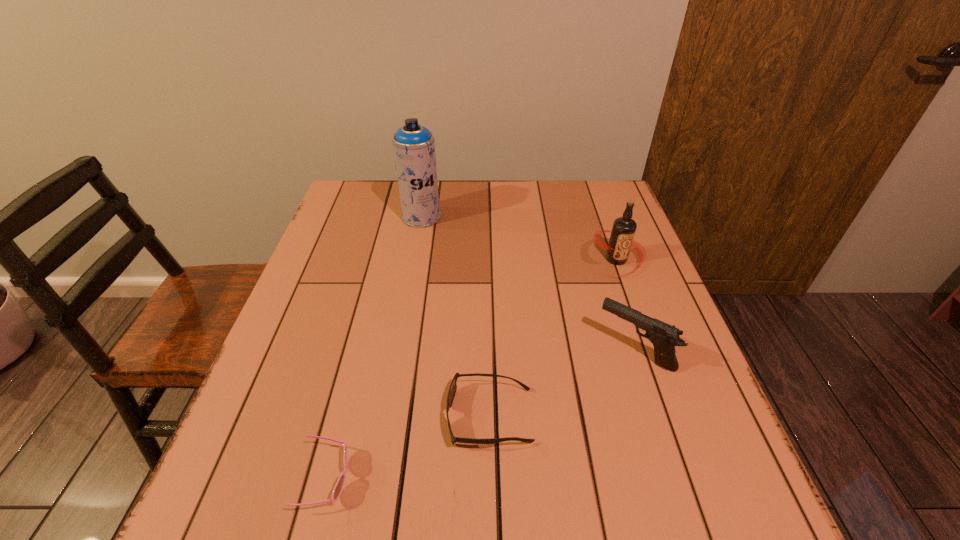
What are the coordinates of `empty space between the gun and the tallest object` in the screenshot? It's located at (528, 284).

Identify the location of vacant region between the left sunglasses and the farthest object. (373, 348).

This screenshot has width=960, height=540. What are the coordinates of `free point between the right sunglasses and the left sunglasses` in the screenshot? It's located at (408, 448).

At what (x,y) coordinates should I click in order to perform the action: click on free spot between the aerosol can and the root beer. Please return your answer as a coordinate pair (x, y). This screenshot has width=960, height=540. Looking at the image, I should click on (519, 238).

Where is `vacant area that lies between the farthest object and the left sunglasses`? The width and height of the screenshot is (960, 540). vacant area that lies between the farthest object and the left sunglasses is located at coordinates (373, 348).

Find the location of a particular element. This screenshot has width=960, height=540. free spot between the gun and the aerosol can is located at coordinates (528, 284).

Find the location of `free space that is in between the left sunglasses and the third object from right to left`. free space that is in between the left sunglasses and the third object from right to left is located at coordinates (408, 448).

The image size is (960, 540). What are the coordinates of `vacant space that is in between the root beer and the left sunglasses` in the screenshot? It's located at (471, 369).

What are the coordinates of `vacant area between the left sunglasses and the root beer` in the screenshot? It's located at (471, 369).

Image resolution: width=960 pixels, height=540 pixels. Find the location of `blank region between the third tallest object and the right sunglasses`. blank region between the third tallest object and the right sunglasses is located at coordinates (562, 383).